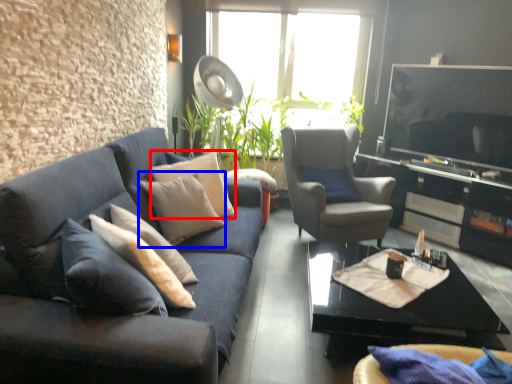
Question: Among these objects, which one is nearest to the camera, pillow (highlighted by a red box) or pillow (highlighted by a blue box)?

Choices:
 (A) pillow
 (B) pillow

Answer: (B)